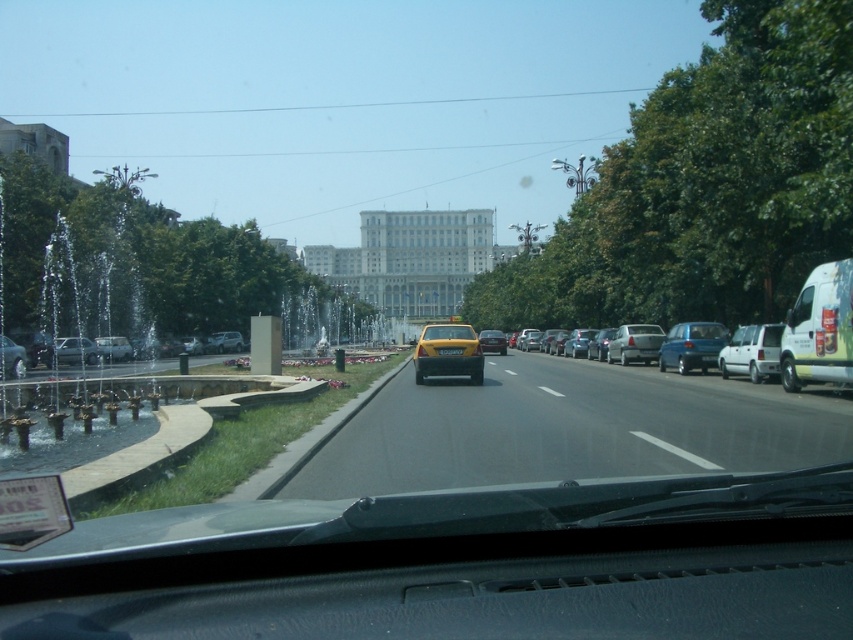
Question: Can you confirm if white matte van at right is thinner than matte black car at left?

Choices:
 (A) no
 (B) yes

Answer: (B)

Question: Which point is closer to the camera?

Choices:
 (A) (479, 342)
 (B) (241, 342)

Answer: (A)

Question: Is silver metallic sedan at center right in front of metallic silver car at center?

Choices:
 (A) no
 (B) yes

Answer: (B)

Question: Which point is closer to the camera taking this photo?

Choices:
 (A) (4, 376)
 (B) (103, 346)
 (C) (213, 339)
 (D) (80, 337)

Answer: (A)

Question: Which object is positioned farthest from the matte silver sedan at left?

Choices:
 (A) yellow matte taxi at center
 (B) matte silver sedan at center-left
 (C) satin silver sedan at center

Answer: (A)

Question: Does matte silver sedan at left appear on the right side of yellow plastic license plate at center?

Choices:
 (A) yes
 (B) no

Answer: (B)